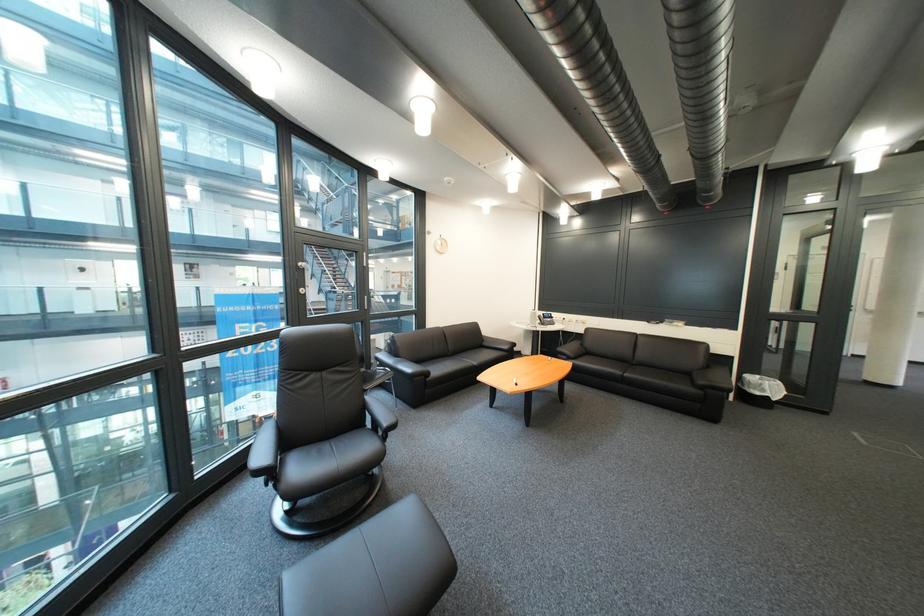
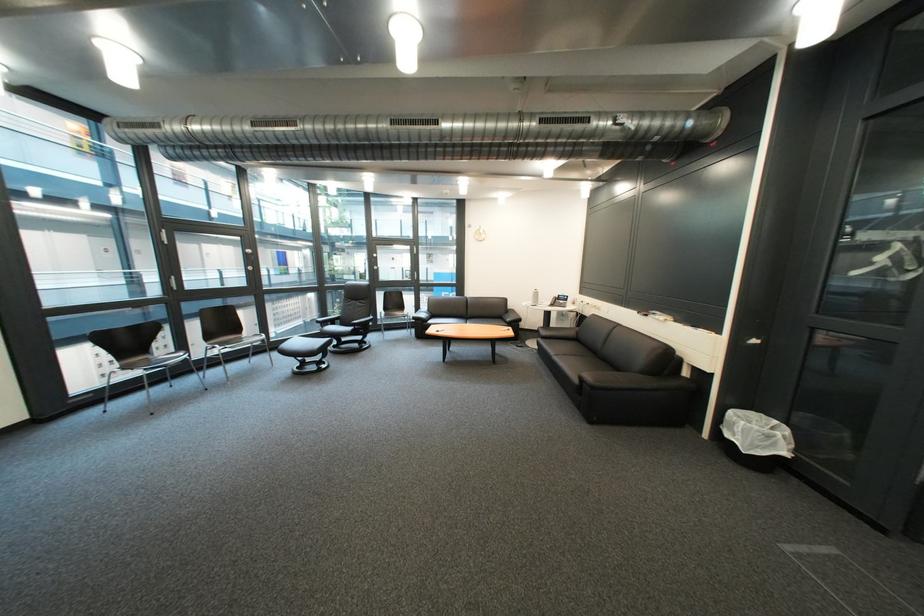
Locate, in the second image, the point that corresponds to pixel 549 325 in the first image.

(552, 305)